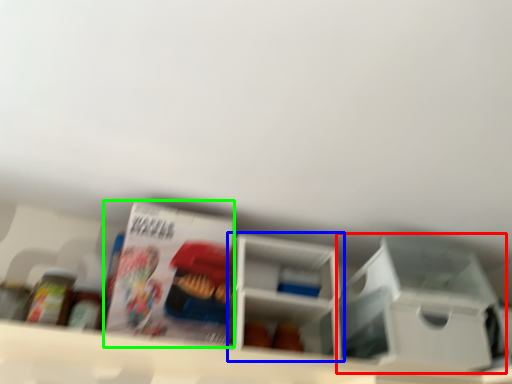
Question: Estimate the real-world distances between objects in this image. Which object is closer to storage box (highlighted by a red box), shelf (highlighted by a blue box) or magazine (highlighted by a green box)?

Choices:
 (A) shelf
 (B) magazine

Answer: (A)